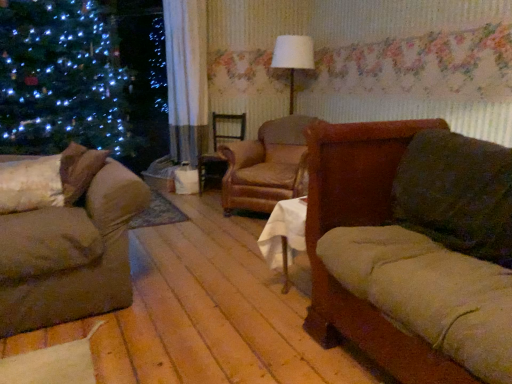
Question: Would you say leather armchair at center is a long distance from velvet brown couch at right, which appears as the first studio couch when viewed from the right?

Choices:
 (A) yes
 (B) no

Answer: (A)

Question: Is leather armchair at center completely or partially outside of velvet brown couch at right, which appears as the first studio couch when viewed from the right?

Choices:
 (A) no
 (B) yes

Answer: (B)

Question: Is leather armchair at center smaller than velvet brown couch at right, which appears as the first studio couch when viewed from the right?

Choices:
 (A) yes
 (B) no

Answer: (A)

Question: Is leather armchair at center positioned behind velvet brown couch at right, which appears as the first studio couch when viewed from the right?

Choices:
 (A) no
 (B) yes

Answer: (B)

Question: Does leather armchair at center have a larger size compared to velvet brown couch at right, the second studio couch in the left-to-right sequence?

Choices:
 (A) yes
 (B) no

Answer: (B)

Question: Can you confirm if leather armchair at center is wider than velvet brown couch at right, the second studio couch in the left-to-right sequence?

Choices:
 (A) no
 (B) yes

Answer: (B)

Question: Can you confirm if velvet brown couch at left, the first studio couch from the left, is positioned to the left of leather armchair at center?

Choices:
 (A) no
 (B) yes

Answer: (B)

Question: Does velvet brown couch at left, the first studio couch from the left, come in front of leather armchair at center?

Choices:
 (A) no
 (B) yes

Answer: (B)

Question: From the image's perspective, does velvet brown couch at left, which is counted as the 2th studio couch, starting from the right, appear lower than leather armchair at center?

Choices:
 (A) yes
 (B) no

Answer: (A)

Question: Does velvet brown couch at left, the first studio couch from the left, have a smaller size compared to leather armchair at center?

Choices:
 (A) no
 (B) yes

Answer: (B)

Question: Is velvet brown couch at left, which is counted as the 2th studio couch, starting from the right, to the right of leather armchair at center from the viewer's perspective?

Choices:
 (A) yes
 (B) no

Answer: (B)

Question: Would you say velvet brown couch at left, the first studio couch from the left, contains leather armchair at center?

Choices:
 (A) yes
 (B) no

Answer: (B)

Question: Considering the relative positions of white fabric lampshade at center and velvet brown couch at left, the first studio couch from the left, in the image provided, is white fabric lampshade at center in front of velvet brown couch at left, the first studio couch from the left,?

Choices:
 (A) yes
 (B) no

Answer: (B)